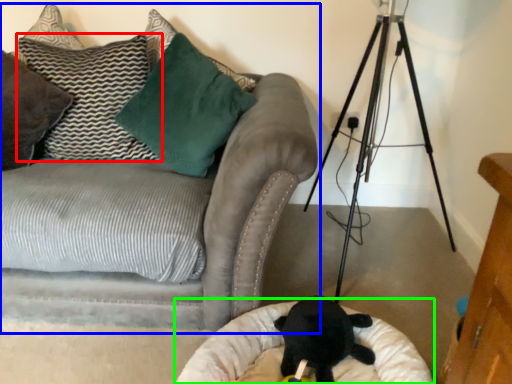
Question: Considering the real-world distances, which object is farthest from pillow (highlighted by a red box)? studio couch (highlighted by a blue box) or cat bed (highlighted by a green box)?

Choices:
 (A) studio couch
 (B) cat bed

Answer: (B)